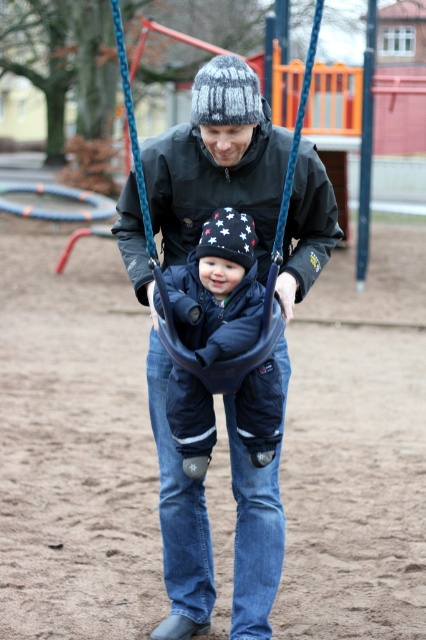
You are a parent trying to ensure your child is safe while swinging. You notice the dark blue jeans at center and the dark blue fabric baby swing at center. Which object is taller, and why does this matter for safety?

The dark blue jeans at center is taller than the dark blue fabric baby swing at center. This matters for safety because the parent can easily monitor and assist the child while pushing the swing without needing to bend down too much, ensuring better control and stability.

You are standing at point (276, 388) and want to walk to point (169, 524). Is there a clear path between these two points?

Point (169, 524) is behind point (276, 388), so there is a clear path between them.